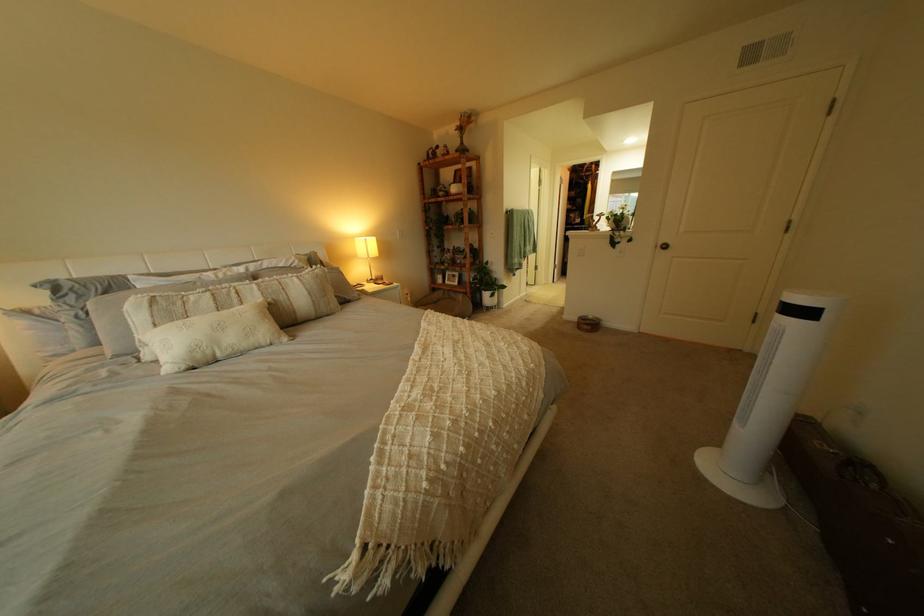
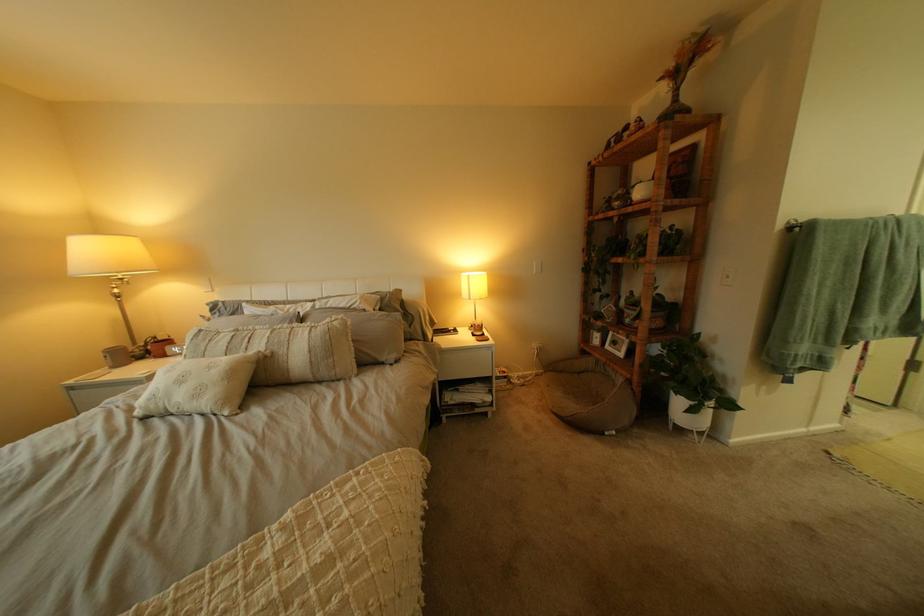
Question: I am providing you with two images of the same scene from different viewpoints. After the viewpoint changes to image2, which objects are now occluded?

Choices:
 (A) dark decorative vase
 (B) white plant pot
 (C) long textured pillow
 (D) none of these

Answer: (D)